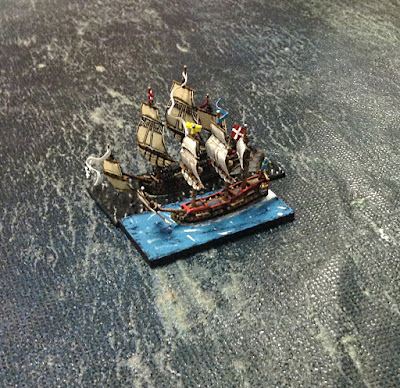
Locate an element on the screen. The width and height of the screenshot is (400, 388). canvas is located at coordinates (302, 235).